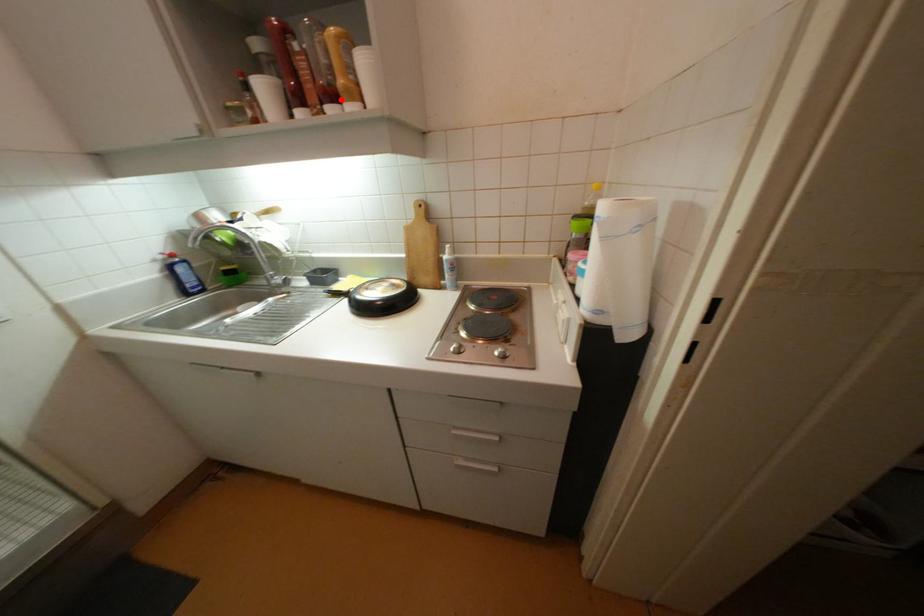
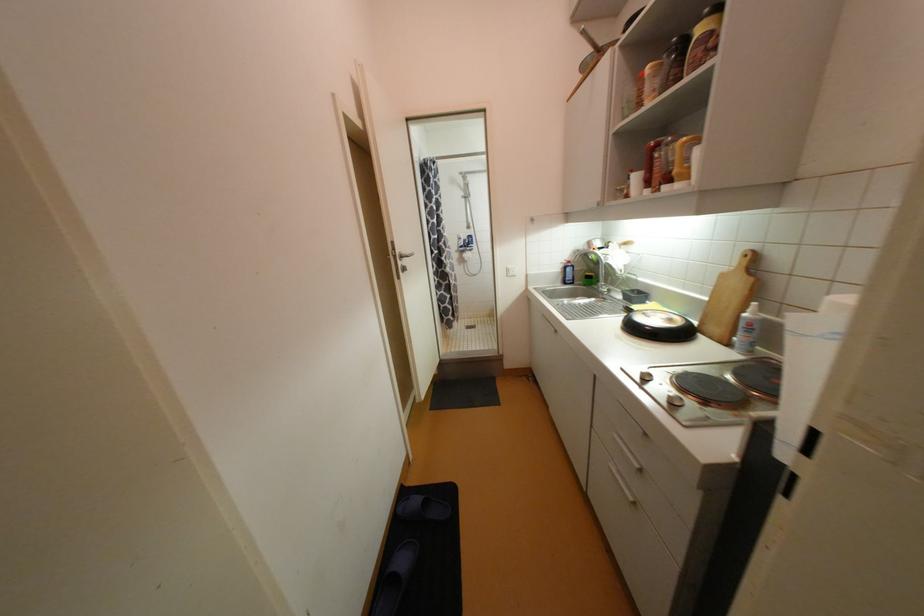
The point at the highlighted location is marked in the first image. Where is the corresponding point in the second image?

(675, 180)